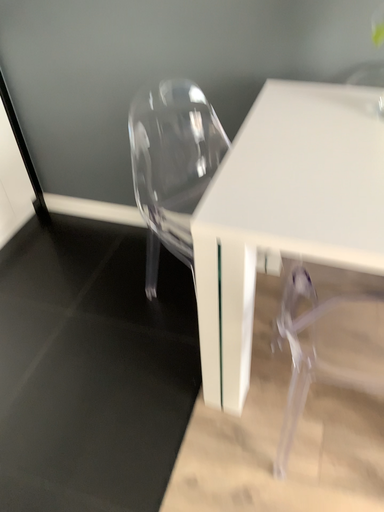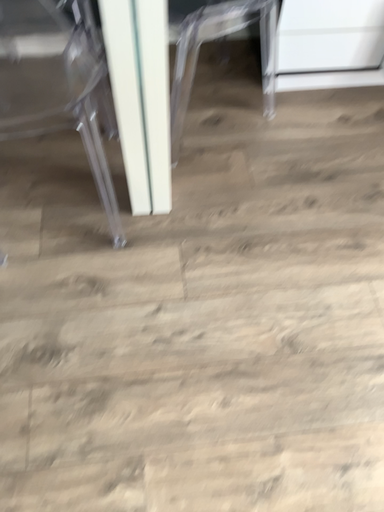
Question: How did the camera likely rotate when shooting the video?

Choices:
 (A) rotated upward
 (B) rotated downward

Answer: (B)